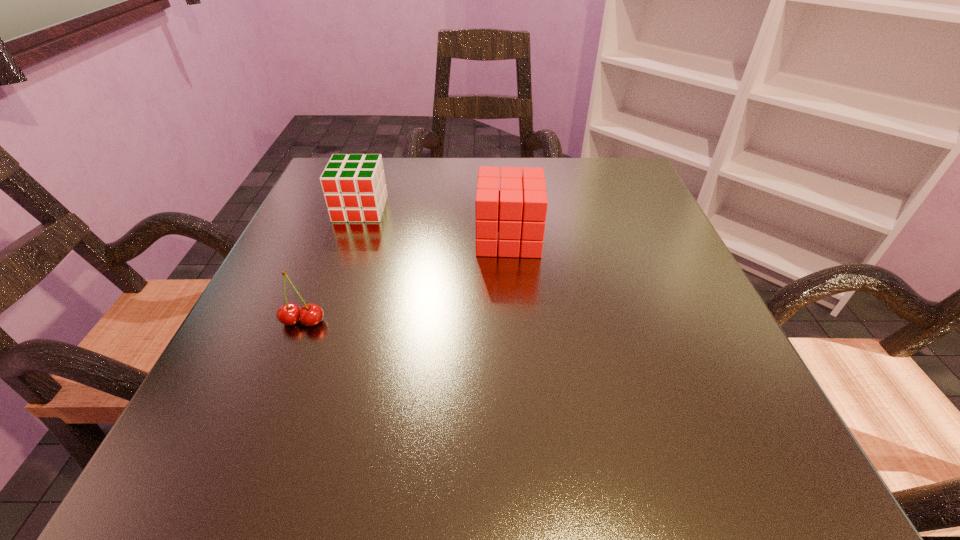
I want to click on the rightmost object, so click(518, 211).

The image size is (960, 540). Identify the location of the taller cube. (518, 211).

Locate an element on the screen. the left cube is located at coordinates (354, 188).

This screenshot has height=540, width=960. I want to click on the nearest object, so click(311, 314).

You are a GUI agent. You are given a task and a screenshot of the screen. Output one action in this format:
    pyautogui.click(x=<x>, y=<y>)
    Task: Click on the vacant position located on the left of the taller cube
    The image size is (960, 540).
    Given the screenshot: What is the action you would take?
    pyautogui.click(x=444, y=238)

Locate an element on the screen. Image resolution: width=960 pixels, height=540 pixels. free space located on the red face of the shorter cube is located at coordinates pyautogui.click(x=298, y=383).

Where is `vacant space located with the stems of the nearest object pointing upwards`? The height and width of the screenshot is (540, 960). vacant space located with the stems of the nearest object pointing upwards is located at coordinates (284, 368).

This screenshot has height=540, width=960. Identify the location of object present at the far edge. (354, 188).

Find the location of `cube present at the left edge`. cube present at the left edge is located at coordinates (354, 188).

Identify the location of cherry present at the left edge. The height and width of the screenshot is (540, 960). (311, 314).